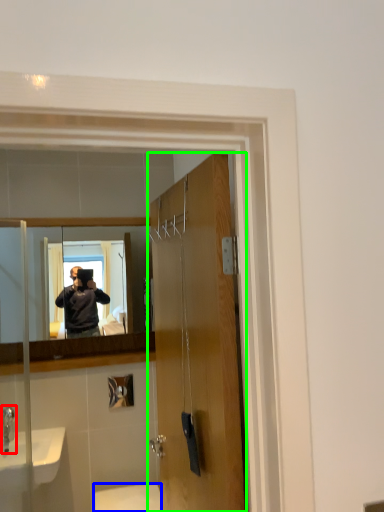
Question: Which object is positioned farthest from faucet (highlighted by a red box)? Select from toilet (highlighted by a blue box) and door (highlighted by a green box).

Choices:
 (A) toilet
 (B) door

Answer: (B)